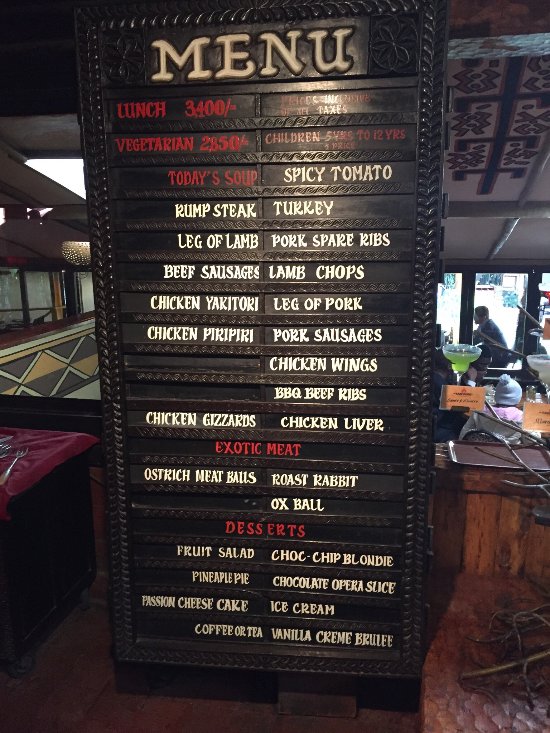
Locate an element on the screen. The image size is (550, 733). tables is located at coordinates (493, 364).